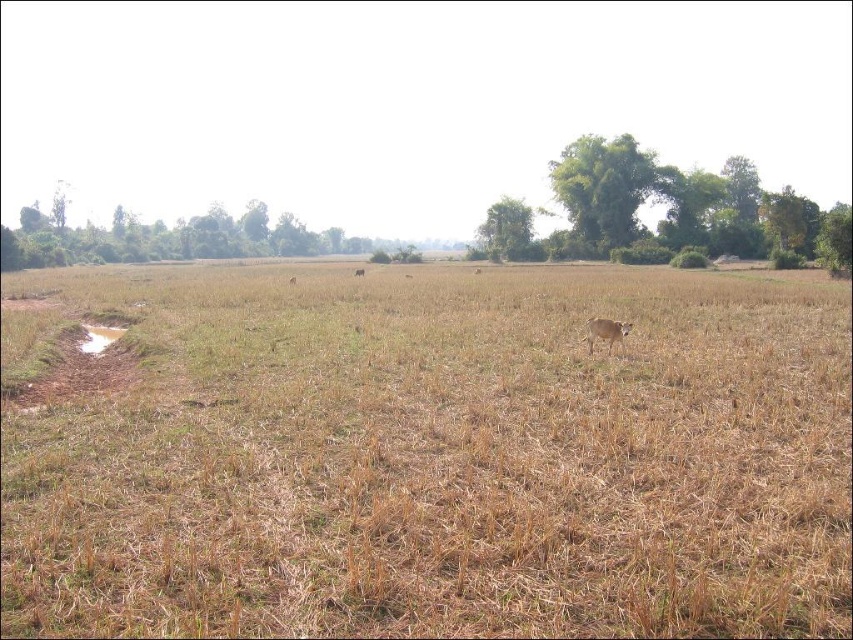
You are a farmer who needs to separate two cows for feeding. The brown furry cow at center and the brown matte cow at center are currently in the same field. Given their distance apart, can you estimate if you can easily walk between them to guide them to separate pens?

The brown furry cow at center is 33.03 meters from the brown matte cow at center. Since this distance is quite large, you can easily walk between them to guide them to separate pens as there is sufficient space.